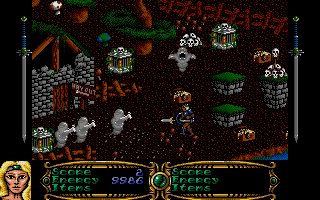
Find the location of a particular element. The height and width of the screenshot is (200, 320). stone top is located at coordinates (228, 75).